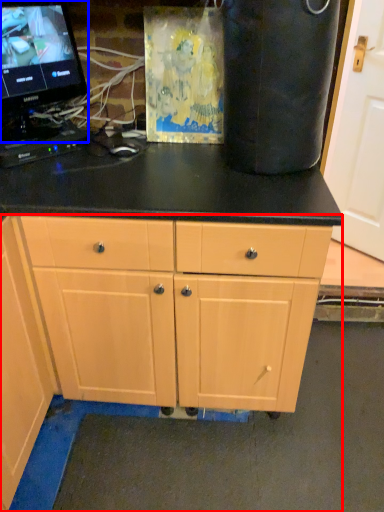
Question: Which object appears closest to the camera in this image, cabinet (highlighted by a red box) or computer monitor (highlighted by a blue box)?

Choices:
 (A) cabinet
 (B) computer monitor

Answer: (A)